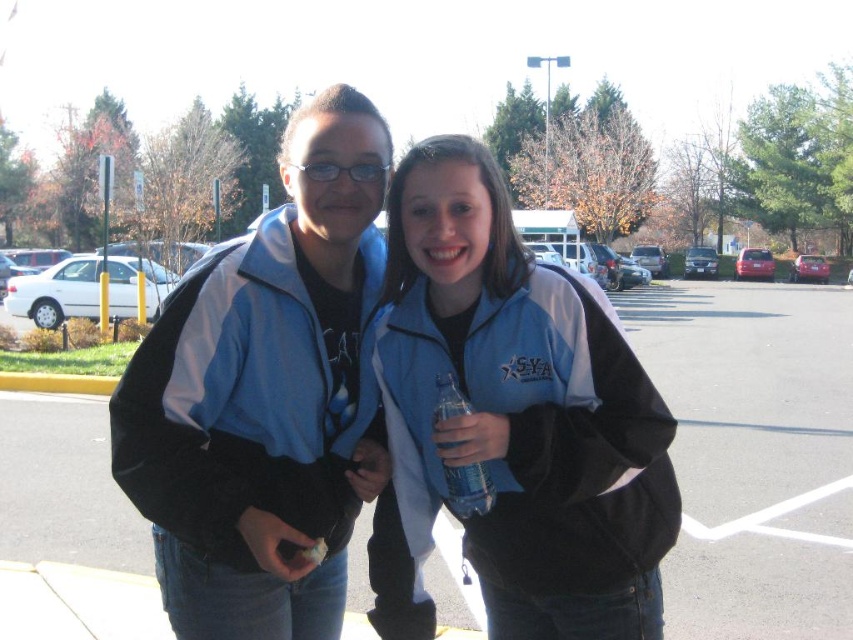
Is point (665, 516) farther from camera compared to point (703, 531)?

No, (665, 516) is in front of (703, 531).

Does point (521, 577) come farther from viewer compared to point (721, 413)?

No, (521, 577) is in front of (721, 413).

Identify the location of blue fleece jacket at center. (514, 419).

Which is above, matte blue jacket at center or clear plastic water bottle at center?

clear plastic water bottle at center is higher up.

Does point (753, 282) come closer to viewer compared to point (474, 496)?

No.

What are the coordinates of `matte blue jacket at center` in the screenshot? It's located at (755, 452).

How much distance is there between blue fleece jacket at center and clear plastic water bottle at center?

blue fleece jacket at center and clear plastic water bottle at center are 8.20 inches apart.

Is point (486, 291) closer to viewer compared to point (453, 385)?

No.

Measure the distance between blue fleece jacket at center and camera.

blue fleece jacket at center is 6.19 feet from camera.

Where is `blue fleece jacket at center`? This screenshot has height=640, width=853. blue fleece jacket at center is located at coordinates (514, 419).